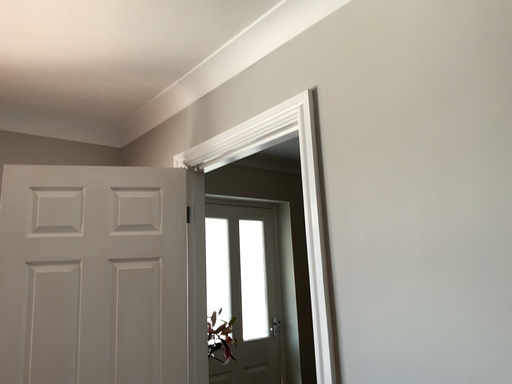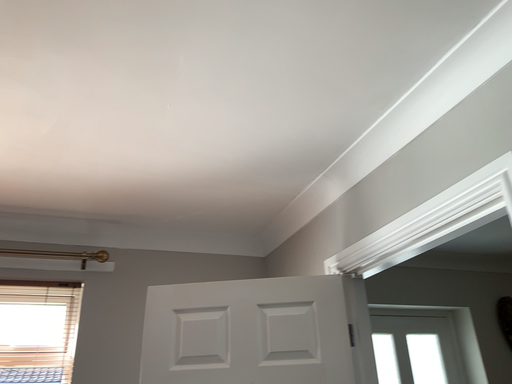
Question: How did the camera likely rotate when shooting the video?

Choices:
 (A) rotated left
 (B) rotated right

Answer: (A)